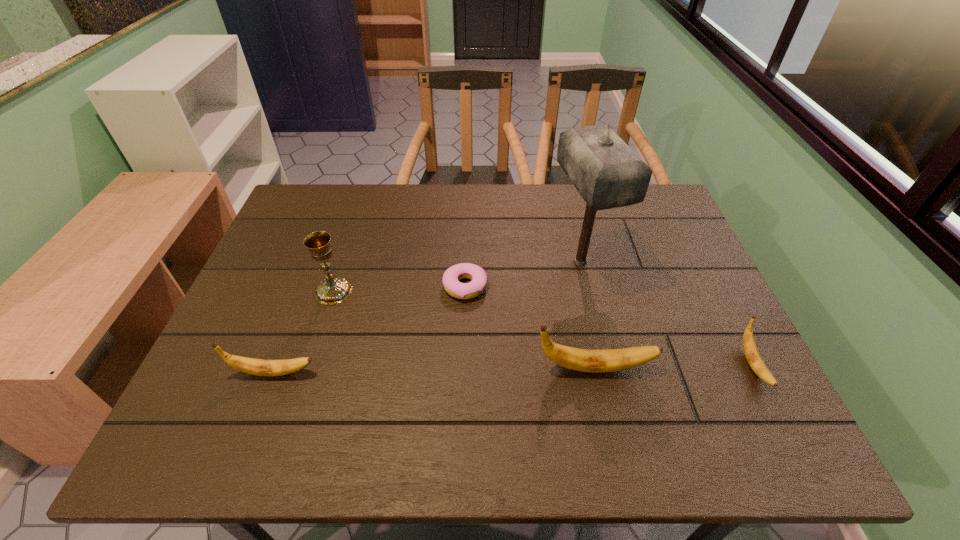
The height and width of the screenshot is (540, 960). Find the location of `vacant area that lies between the fifth tallest object and the mallet`. vacant area that lies between the fifth tallest object and the mallet is located at coordinates (666, 314).

This screenshot has height=540, width=960. What are the coordinates of `empty location between the second banana from right to left and the doughnut` in the screenshot? It's located at (530, 327).

This screenshot has width=960, height=540. I want to click on free spot between the shortest object and the fifth tallest object, so click(609, 326).

Find the location of a particular element. The image size is (960, 540). object identified as the second closest to the second shortest object is located at coordinates (607, 173).

Select which object is the third closest to the second tallest object. Please provide its 2D coordinates. Your answer should be formatted as a tuple, i.e. [(x, y)], where the tuple contains the x and y coordinates of a point satisfying the conditions above.

[(585, 360)]

Find the location of a particular element. banana that is the closest to the chalice is located at coordinates (261, 367).

Identify the location of banana identified as the closest to the second banana from left to right. (753, 357).

Identify the location of blank area in the image that satisfies the following two spatial constraints: 1. on the peel of the second shortest object from the top; 2. on the peel of the second banana from left to right from the top. The width and height of the screenshot is (960, 540). (754, 368).

At what (x,y) coordinates should I click in order to perform the action: click on vacant space that satisfies the following two spatial constraints: 1. on the front side of the tallest object; 2. on the peel of the second banana from right to left from the top. Please return your answer as a coordinate pair (x, y). Image resolution: width=960 pixels, height=540 pixels. Looking at the image, I should click on (605, 368).